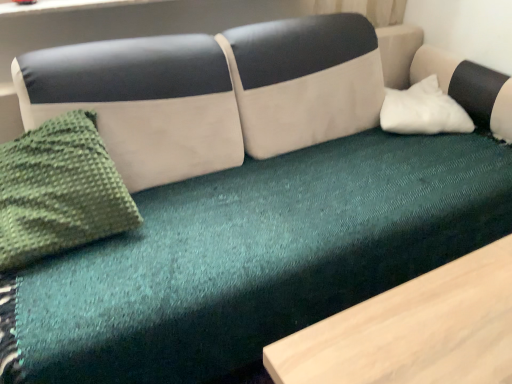
Describe the element at coordinates (423, 110) in the screenshot. I see `white soft pillow at right` at that location.

Measure the distance between point (447, 116) and camera.

The distance of point (447, 116) from camera is 1.78 meters.

Find the location of a particular element. white soft pillow at right is located at coordinates (423, 110).

Locate an element on the screen. green knitted throw pillow at left is located at coordinates (59, 191).

This screenshot has width=512, height=384. Describe the element at coordinates (59, 191) in the screenshot. I see `green knitted throw pillow at left` at that location.

Image resolution: width=512 pixels, height=384 pixels. I want to click on white soft pillow at right, so click(x=423, y=110).

Considering the relative positions of white soft pillow at right and green knitted throw pillow at left in the image provided, is white soft pillow at right to the left of green knitted throw pillow at left from the viewer's perspective?

Incorrect, white soft pillow at right is not on the left side of green knitted throw pillow at left.

Which object is further away from the camera taking this photo, white soft pillow at right or green knitted throw pillow at left?

white soft pillow at right.

Based on the photo, which point is more distant from viewer, (x=409, y=126) or (x=85, y=235)?

The point (x=409, y=126) is farther from the camera.

In the scene shown: From the image's perspective, is white soft pillow at right below green knitted throw pillow at left?

No.

From a real-world perspective, which is physically below, white soft pillow at right or green knitted throw pillow at left?

white soft pillow at right.

Does white soft pillow at right have a lesser width compared to green knitted throw pillow at left?

Incorrect, the width of white soft pillow at right is not less than that of green knitted throw pillow at left.

Can you confirm if white soft pillow at right is taller than green knitted throw pillow at left?

Incorrect, the height of white soft pillow at right is not larger of that of green knitted throw pillow at left.

Is white soft pillow at right bigger than green knitted throw pillow at left?

No, white soft pillow at right is not bigger than green knitted throw pillow at left.

Is white soft pillow at right inside or outside of green knitted throw pillow at left?

white soft pillow at right is not enclosed by green knitted throw pillow at left.

Is white soft pillow at right not close to green knitted throw pillow at left?

That's right, there is a large distance between white soft pillow at right and green knitted throw pillow at left.

Is white soft pillow at right facing towards green knitted throw pillow at left?

No, white soft pillow at right is not turned towards green knitted throw pillow at left.

What's the angular difference between white soft pillow at right and green knitted throw pillow at left's facing directions?

0.000992 degrees.

Where is `pillow behind the green knitted throw pillow at left`? pillow behind the green knitted throw pillow at left is located at coordinates (423, 110).

Is green knitted throw pillow at left to the right of white soft pillow at right from the viewer's perspective?

No, green knitted throw pillow at left is not to the right of white soft pillow at right.

Which object is more forward, green knitted throw pillow at left or white soft pillow at right?

green knitted throw pillow at left is in front.

Which point is more distant from viewer, (x=22, y=234) or (x=398, y=100)?

The point (x=398, y=100) is more distant.

From the image's perspective, would you say green knitted throw pillow at left is shown under white soft pillow at right?

Yes, from the image's perspective, green knitted throw pillow at left is beneath white soft pillow at right.

From a real-world perspective, is green knitted throw pillow at left above or below white soft pillow at right?

From a real-world perspective, green knitted throw pillow at left is physically above white soft pillow at right.

Does green knitted throw pillow at left have a greater width compared to white soft pillow at right?

No.

Considering the sizes of objects green knitted throw pillow at left and white soft pillow at right in the image provided, who is shorter, green knitted throw pillow at left or white soft pillow at right?

white soft pillow at right.

Who is bigger, green knitted throw pillow at left or white soft pillow at right?

Bigger between the two is green knitted throw pillow at left.

In the scene shown: Choose the correct answer: Is green knitted throw pillow at left inside white soft pillow at right or outside it?

green knitted throw pillow at left is spatially situated outside white soft pillow at right.

Is green knitted throw pillow at left beside white soft pillow at right?

No, green knitted throw pillow at left is not beside white soft pillow at right.

Could you tell me if green knitted throw pillow at left is turned towards white soft pillow at right?

No.

How different are the orientations of green knitted throw pillow at left and white soft pillow at right in degrees?

The angle between the facing direction of green knitted throw pillow at left and the facing direction of white soft pillow at right is 0.000992 degrees.

You are a GUI agent. You are given a task and a screenshot of the screen. Output one action in this format:
    pyautogui.click(x=<x>, y=<y>)
    Task: Click on the pillow that is above the green knitted throw pillow at left (from the image's perspective)
    The width and height of the screenshot is (512, 384).
    Given the screenshot: What is the action you would take?
    pyautogui.click(x=423, y=110)

Locate an element on the screen. pillow below the green knitted throw pillow at left (from a real-world perspective) is located at coordinates (423, 110).

Image resolution: width=512 pixels, height=384 pixels. Find the location of `pillow behind the green knitted throw pillow at left`. pillow behind the green knitted throw pillow at left is located at coordinates coord(423,110).